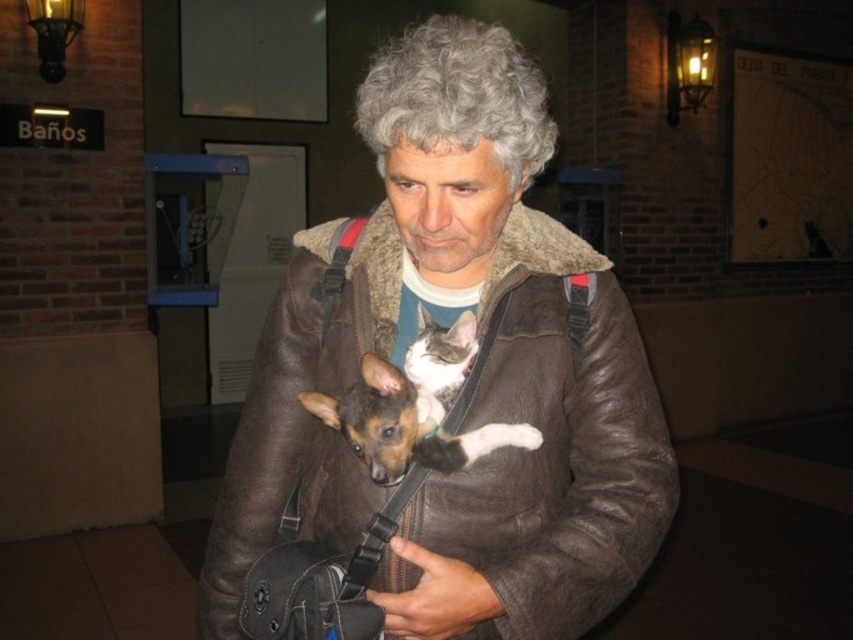
Question: Which point is farther from the camera taking this photo?

Choices:
 (A) (460, 113)
 (B) (436, 380)

Answer: (B)

Question: Considering the real-world distances, which object is farthest from the gray curly wig at center?

Choices:
 (A) brown leather jacket at center
 (B) brown leather dog at center

Answer: (A)

Question: Considering the relative positions of brown leather jacket at center and gray curly wig at center in the image provided, where is brown leather jacket at center located with respect to gray curly wig at center?

Choices:
 (A) below
 (B) above

Answer: (A)

Question: Where is brown leather jacket at center located in relation to gray curly wig at center in the image?

Choices:
 (A) above
 (B) below

Answer: (B)

Question: Which point is farther to the camera?

Choices:
 (A) gray curly wig at center
 (B) brown leather dog at center
 (C) brown leather jacket at center

Answer: (C)

Question: Observing the image, what is the correct spatial positioning of gray curly wig at center in reference to brown leather dog at center?

Choices:
 (A) left
 (B) right

Answer: (B)